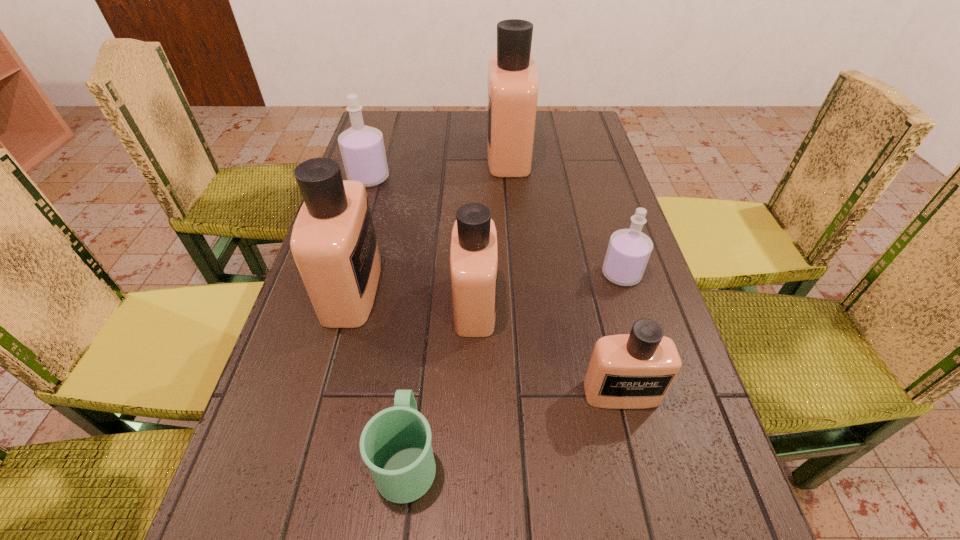
Locate an element on the screen. This screenshot has height=540, width=960. the farthest beige perfume is located at coordinates (513, 81).

Image resolution: width=960 pixels, height=540 pixels. Find the location of `the tallest object`. the tallest object is located at coordinates (513, 81).

Identify the location of the second biggest beige perfume. The image size is (960, 540). coord(333,242).

The image size is (960, 540). What are the coordinates of `the leftmost beige perfume` in the screenshot? It's located at (333, 242).

Image resolution: width=960 pixels, height=540 pixels. Identify the location of the bigger purple perfume. (362, 148).

The height and width of the screenshot is (540, 960). I want to click on the farther purple perfume, so click(362, 148).

I want to click on the third biggest beige perfume, so [474, 251].

At what (x,y) coordinates should I click in order to perform the action: click on the nearer purple perfume. Please return your answer as a coordinate pair (x, y). This screenshot has width=960, height=540. Looking at the image, I should click on (628, 252).

Locate an element on the screen. The width and height of the screenshot is (960, 540). the smaller purple perfume is located at coordinates (628, 252).

Locate an element on the screen. the nearest perfume is located at coordinates (626, 371).